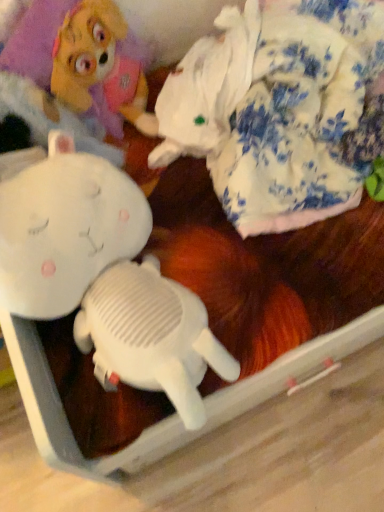
Locate an element on the screen. free spot above white matte toy at center, marked as the second toy in a right-to-left arrangement (from a real-world perspective) is located at coordinates (134, 315).